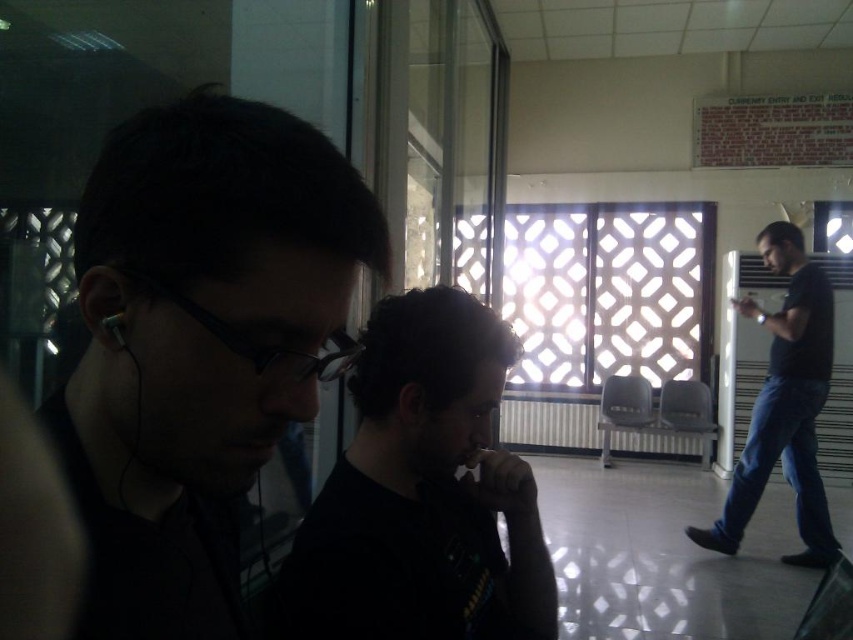
Can you confirm if black matte shirt at center is bigger than black matte shirt at right?

No, black matte shirt at center is not bigger than black matte shirt at right.

Does black matte shirt at center appear on the left side of black matte shirt at right?

Indeed, black matte shirt at center is positioned on the left side of black matte shirt at right.

Does point (393, 483) come in front of point (773, 358)?

Yes.

Identify the location of black matte shirt at center. (422, 493).

Is matte black glasses at left taller than black matte shirt at right?

In fact, matte black glasses at left may be shorter than black matte shirt at right.

What do you see at coordinates (199, 346) in the screenshot?
I see `matte black glasses at left` at bounding box center [199, 346].

Where is `matte black glasses at left`? matte black glasses at left is located at coordinates (199, 346).

Locate an element on the screen. The image size is (853, 640). matte black glasses at left is located at coordinates (199, 346).

Does matte black glasses at left appear under black matte shirt at center?

Incorrect, matte black glasses at left is not positioned below black matte shirt at center.

Can you confirm if matte black glasses at left is shorter than black matte shirt at center?

Yes.

This screenshot has height=640, width=853. What do you see at coordinates (199, 346) in the screenshot?
I see `matte black glasses at left` at bounding box center [199, 346].

At what (x,y) coordinates should I click in order to perform the action: click on matte black glasses at left. Please return your answer as a coordinate pair (x, y). The width and height of the screenshot is (853, 640). Looking at the image, I should click on (199, 346).